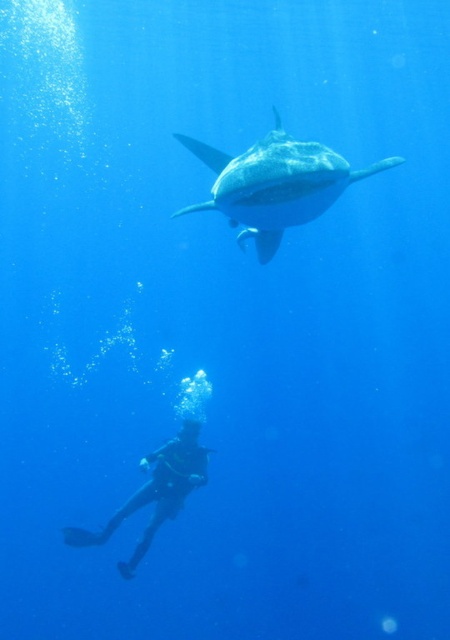
Is smooth gray shark at upper center smaller than black rubber wetsuit at lower left?

Actually, smooth gray shark at upper center might be larger than black rubber wetsuit at lower left.

Who is lower down, smooth gray shark at upper center or black rubber wetsuit at lower left?

Positioned lower is black rubber wetsuit at lower left.

Describe the element at coordinates (274, 184) in the screenshot. This screenshot has width=450, height=640. I see `smooth gray shark at upper center` at that location.

Find the location of a particular element. This screenshot has width=450, height=640. smooth gray shark at upper center is located at coordinates tap(274, 184).